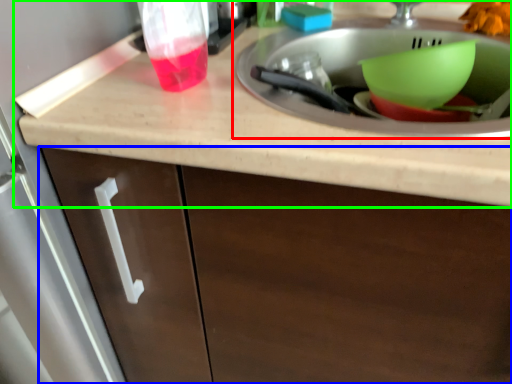
Question: Based on their relative distances, which object is nearer to sink (highlighted by a red box)? Choose from cabinetry (highlighted by a blue box) and countertop (highlighted by a green box).

Choices:
 (A) cabinetry
 (B) countertop

Answer: (B)